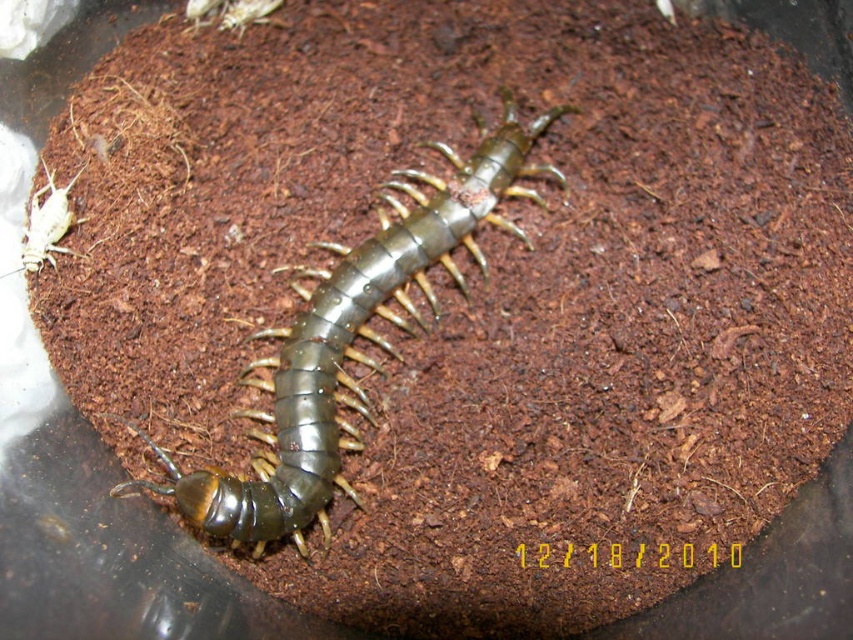
You are a biologist observing the terrarium. You need to determine if the shiny metallic centipede at center can reach the white matte cricket at left for feeding. Based on their positions, is the centipede able to reach the cricket?

The shiny metallic centipede at center is positioned under the white matte cricket at left, so the centipede can reach the cricket by moving upward from its current position.

You are a researcher studying the centipede in the terrarium. You need to place a food dish near its current position at point (349, 342). Where should you place the dish relative to the centipede?

The shiny metallic centipede at center is located at point (349, 342), so you should place the food dish near that coordinate to ensure proximity to the centipede.